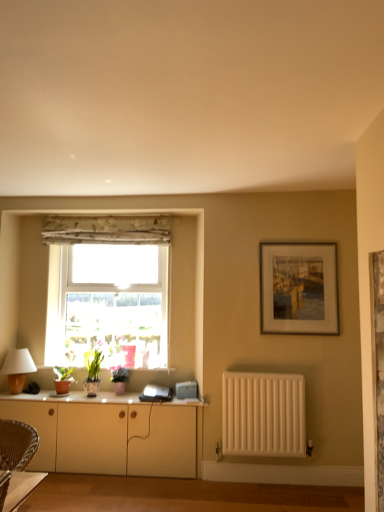
Find the location of a particular element. vacant region under white matte radiator at lower right (from a real-world perspective) is located at coordinates (272, 481).